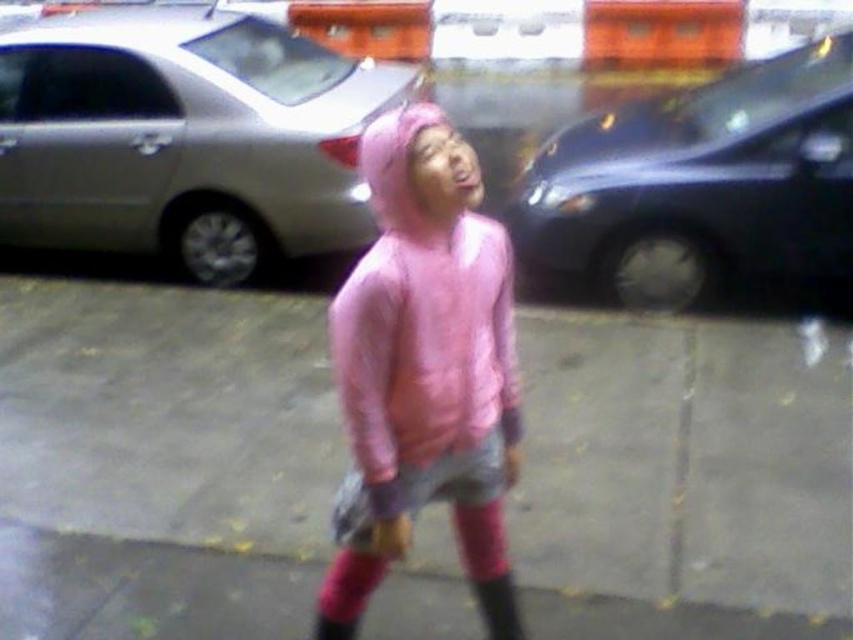
You are a delivery person who needs to place a small package on the shiny black car at right without it sliding off. Considering the pink rubber rain boot at center is in the way, which object should you avoid stepping on to ensure stability?

The shiny black car at right has a greater height compared to the pink rubber rain boot at center. Therefore, you should avoid stepping on the pink rubber rain boot at center to ensure stability, as it is lower and might not provide a stable base.

You are a photographer trying to capture the reflection of the parked cars in the gray concrete pavement at center. Since the pink rubber rain boot at center is blocking part of the pavement, will you be able to move the boot to get a clearer shot?

The gray concrete pavement at center is larger in size than the pink rubber rain boot at center, so moving the boot would leave enough space to capture the reflection of the parked cars.